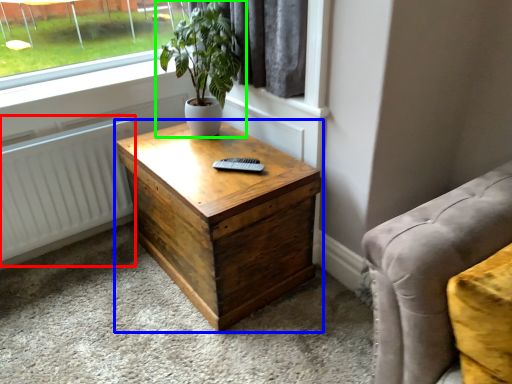
Question: Which object is positioned closest to radiator (highlighted by a red box)? Select from nightstand (highlighted by a blue box) and houseplant (highlighted by a green box).

Choices:
 (A) nightstand
 (B) houseplant

Answer: (A)